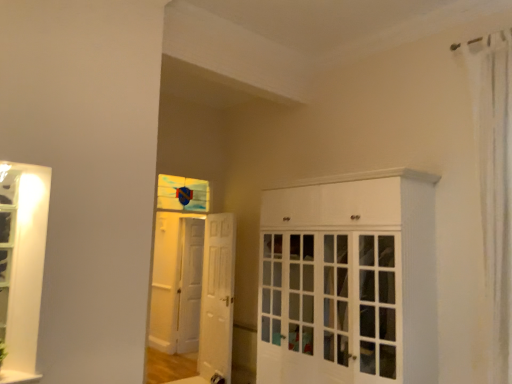
Question: Is point (210, 367) positioned closer to the camera than point (498, 72)?

Choices:
 (A) closer
 (B) farther

Answer: (B)

Question: Looking at their shapes, would you say white wooden door at center, the 2th door when ordered from left to right, is wider or thinner than white sheer curtain at right?

Choices:
 (A) thin
 (B) wide

Answer: (A)

Question: Estimate the real-world distances between objects in this image. Which object is closer to the white glossy cabinet at center?

Choices:
 (A) white glossy door at center, marked as the 1th door in a back-to-front arrangement
 (B) white wooden door at center, which appears as the 1th door when viewed from the front
 (C) white glossy window sill at lower left
 (D) white sheer curtain at right
 (E) stained glass window at center

Answer: (D)

Question: Estimate the real-world distances between objects in this image. Which object is farther from the white wooden door at center, the first door from the right?

Choices:
 (A) stained glass window at center
 (B) white glossy door at center, marked as the 1th door in a back-to-front arrangement
 (C) white glossy window sill at lower left
 (D) white sheer curtain at right
 (E) white glossy cabinet at center

Answer: (D)